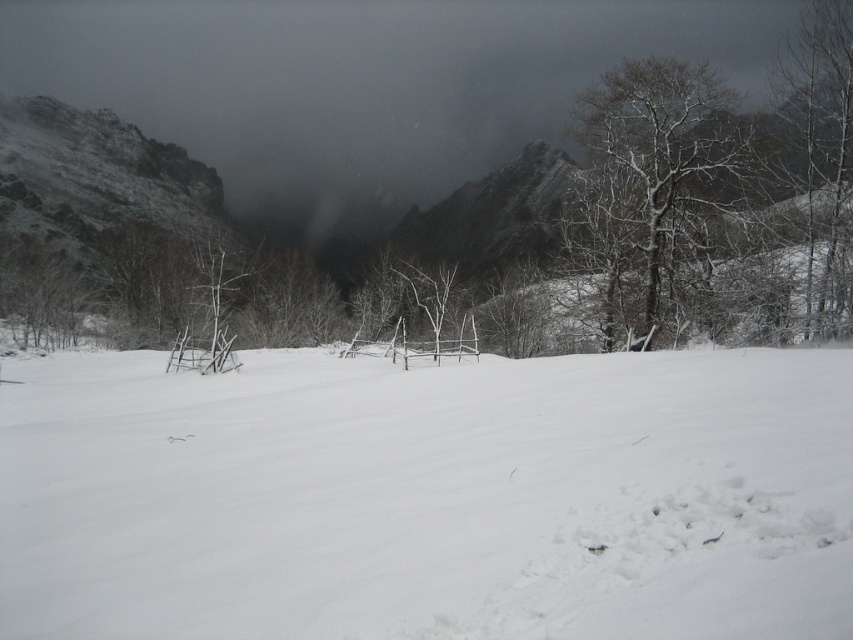
You are standing at the point labeled point (x=807, y=35) and want to move towards the point labeled point (x=643, y=145). According to the scene description, will you be moving closer to or farther from the camera as you walk towards your destination?

Point (x=643, y=145) is further to the camera than point (x=807, y=35). Therefore, moving from point (x=807, y=35) towards point (x=643, y=145) would mean you are moving closer to the camera.

You are standing at the edge of the snow field and see the point marked as point (428, 497). What is the terrain like at that location?

The terrain at point (428, 497) is white snow at center.